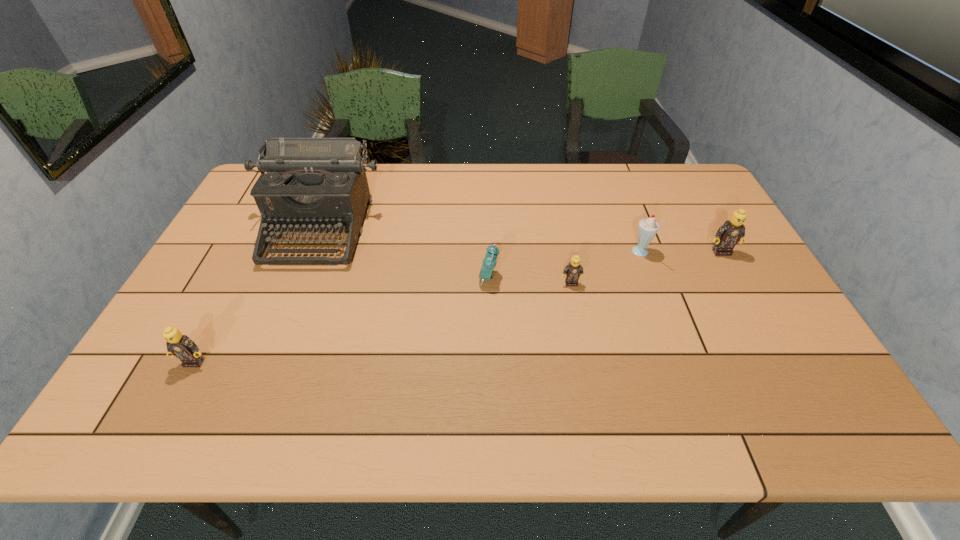
Where is `blank area located in front of the farthest Lego`? The height and width of the screenshot is (540, 960). blank area located in front of the farthest Lego is located at coordinates (767, 334).

Identify the location of free region located 0.200m on the typing side of the typewriter. This screenshot has height=540, width=960. (281, 326).

Where is `free space located 0.060m on the face of the fourth object from right to left`? The height and width of the screenshot is (540, 960). free space located 0.060m on the face of the fourth object from right to left is located at coordinates (457, 278).

Where is `free space located 0.210m on the face of the fourth object from right to left`? This screenshot has height=540, width=960. free space located 0.210m on the face of the fourth object from right to left is located at coordinates (402, 278).

The image size is (960, 540). What are the coordinates of `blank space located on the face of the fourth object from right to left` in the screenshot? It's located at (334, 278).

What are the coordinates of `free space located 0.160m on the straw side of the milkshake` in the screenshot? It's located at 577,253.

Locate an element on the screen. vacant space located 0.240m on the straw side of the milkshake is located at coordinates (549, 253).

You are a GUI agent. You are given a task and a screenshot of the screen. Output one action in this format:
    pyautogui.click(x=<x>, y=<y>)
    Task: Click on the free spot located 0.390m on the straw side of the milkshake
    This screenshot has width=960, height=540.
    Given the screenshot: What is the action you would take?
    pyautogui.click(x=498, y=253)

Where is `object present at the far edge`? object present at the far edge is located at coordinates (313, 184).

Where is `object at the near edge`? object at the near edge is located at coordinates (181, 346).